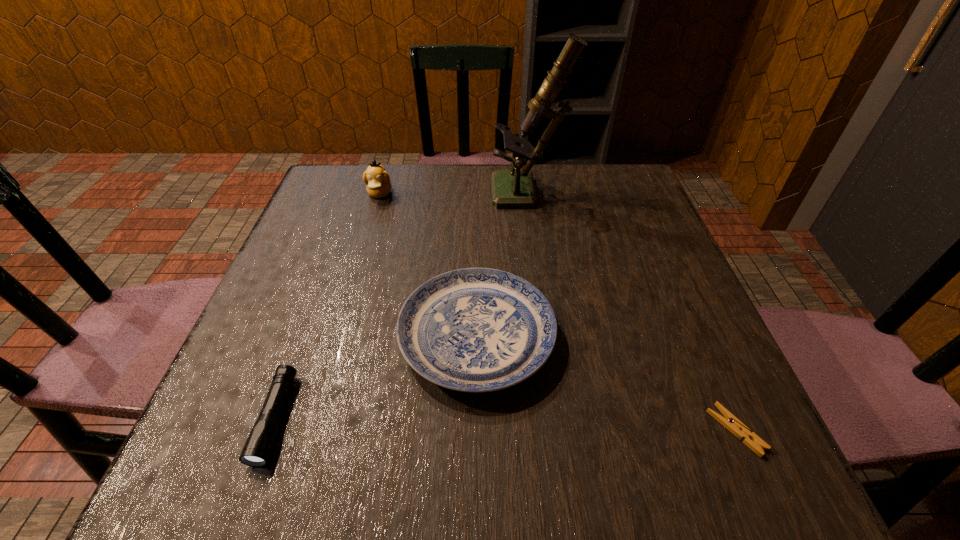
In the image, there is a desktop. Where is `vacant space at the near right corner`? vacant space at the near right corner is located at coordinates (693, 446).

The height and width of the screenshot is (540, 960). What are the coordinates of `free space between the fourth shortest object and the leftmost object` in the screenshot? It's located at (327, 306).

The height and width of the screenshot is (540, 960). I want to click on vacant space in between the tallest object and the second object from left to right, so click(454, 194).

Image resolution: width=960 pixels, height=540 pixels. In order to click on empty space that is in between the plate and the microscope in this screenshot , I will do `click(503, 266)`.

Locate an element on the screen. free area in between the plate and the microscope is located at coordinates (503, 266).

You are a GUI agent. You are given a task and a screenshot of the screen. Output one action in this format:
    pyautogui.click(x=<x>, y=<y>)
    Task: Click on the vacant region between the tallest object and the rightmost object
    The width and height of the screenshot is (960, 540).
    Given the screenshot: What is the action you would take?
    point(633,313)

Locate an element on the screen. The image size is (960, 540). vacant space that is in between the plate and the duckling is located at coordinates (428, 265).

Locate an element on the screen. vacant space that is in between the leftmost object and the plate is located at coordinates (376, 377).

You are a GUI agent. You are given a task and a screenshot of the screen. Output one action in this format:
    pyautogui.click(x=<x>, y=<y>)
    Task: Click on the free space between the rightmost object and the leftmost object
    The height and width of the screenshot is (540, 960).
    Given the screenshot: What is the action you would take?
    pyautogui.click(x=505, y=424)

Find the location of a particular element. empty space that is in between the second object from left to right and the rightmost object is located at coordinates (558, 312).